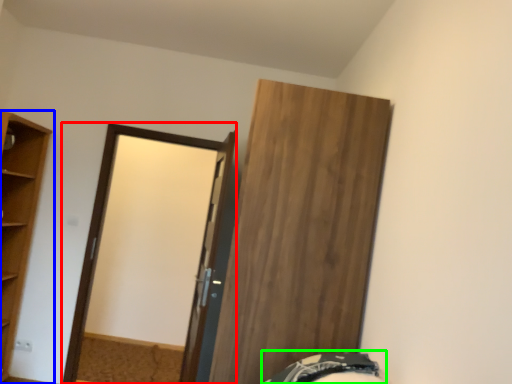
Question: Which is nearer to the screen door (highlighted by a red box)? cupboard (highlighted by a blue box) or bed (highlighted by a green box).

Choices:
 (A) cupboard
 (B) bed

Answer: (A)